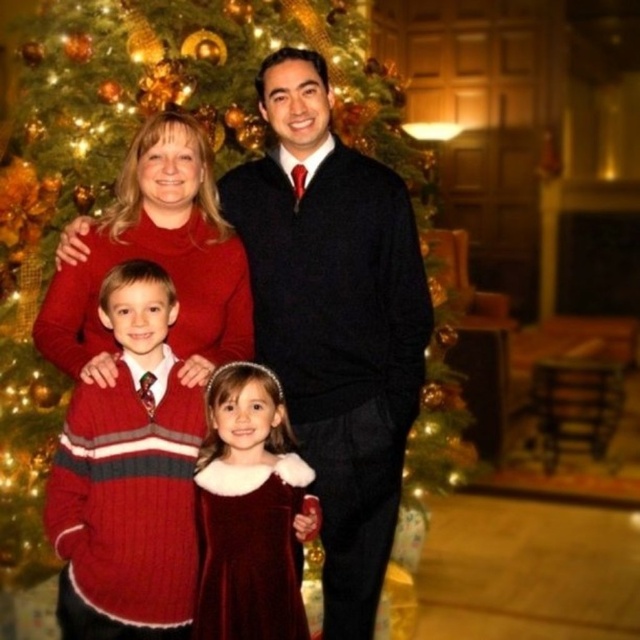
Question: Which point appears farthest from the camera in this image?

Choices:
 (A) pos(282,628)
 (B) pos(372,579)

Answer: (B)

Question: Which of the following is the farthest from the observer?

Choices:
 (A) (120, 561)
 (B) (220, 196)

Answer: (B)

Question: Does green textured christmas tree at center appear on the left side of matte black sweater at center?

Choices:
 (A) no
 (B) yes

Answer: (B)

Question: Is matte black sweater at center to the left of velvet dress at center from the viewer's perspective?

Choices:
 (A) no
 (B) yes

Answer: (A)

Question: Is green textured christmas tree at center positioned in front of cable-knit sweater at left?

Choices:
 (A) no
 (B) yes

Answer: (A)

Question: Which point is farther to the camera?

Choices:
 (A) (352, 193)
 (B) (120, 518)

Answer: (A)